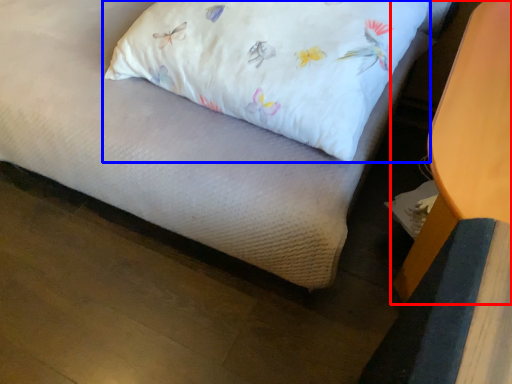
Question: Which of the following is the farthest to the observer, furniture (highlighted by a red box) or pillow (highlighted by a blue box)?

Choices:
 (A) furniture
 (B) pillow

Answer: (B)